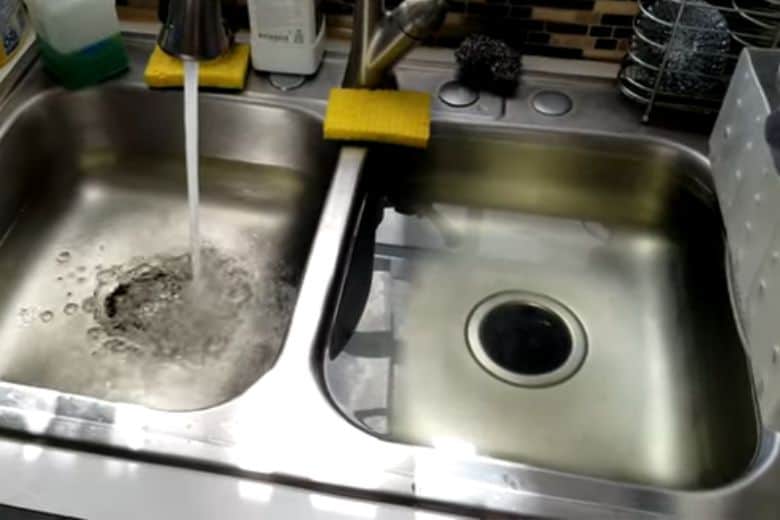
The image size is (780, 520). Identify the location of double silver sink. (175, 248), (555, 349).